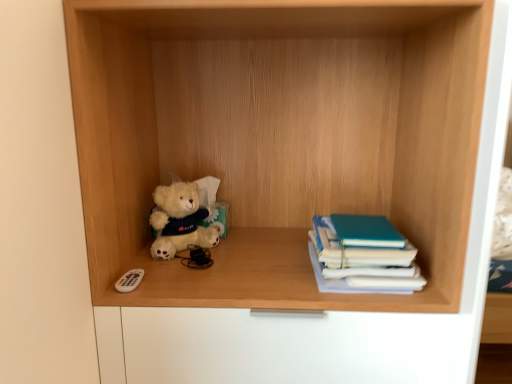
Question: From the image's perspective, would you say teal matte book at right is positioned over white plastic remote control at lower left?

Choices:
 (A) yes
 (B) no

Answer: (A)

Question: Is teal matte book at right taller than white plastic remote control at lower left?

Choices:
 (A) yes
 (B) no

Answer: (A)

Question: From a real-world perspective, is teal matte book at right under white plastic remote control at lower left?

Choices:
 (A) no
 (B) yes

Answer: (A)

Question: Can you confirm if teal matte book at right is wider than white plastic remote control at lower left?

Choices:
 (A) no
 (B) yes

Answer: (B)

Question: Is teal matte book at right located outside white plastic remote control at lower left?

Choices:
 (A) no
 (B) yes

Answer: (B)

Question: From a real-world perspective, does teal matte book at right stand above white plastic remote control at lower left?

Choices:
 (A) yes
 (B) no

Answer: (A)

Question: Considering the relative positions of fluffy white teddy bear at center-left and wooden shelf at center in the image provided, is fluffy white teddy bear at center-left to the right of wooden shelf at center from the viewer's perspective?

Choices:
 (A) no
 (B) yes

Answer: (A)

Question: Is fluffy white teddy bear at center-left smaller than wooden shelf at center?

Choices:
 (A) yes
 (B) no

Answer: (A)

Question: Is fluffy white teddy bear at center-left beside wooden shelf at center?

Choices:
 (A) no
 (B) yes

Answer: (A)

Question: Considering the relative sizes of fluffy white teddy bear at center-left and wooden shelf at center in the image provided, is fluffy white teddy bear at center-left bigger than wooden shelf at center?

Choices:
 (A) no
 (B) yes

Answer: (A)

Question: Is fluffy white teddy bear at center-left further to camera compared to wooden shelf at center?

Choices:
 (A) yes
 (B) no

Answer: (A)

Question: Does fluffy white teddy bear at center-left have a lesser height compared to wooden shelf at center?

Choices:
 (A) yes
 (B) no

Answer: (A)

Question: Can fluffy white teddy bear at center-left be found inside white plastic remote control at lower left?

Choices:
 (A) no
 (B) yes

Answer: (A)